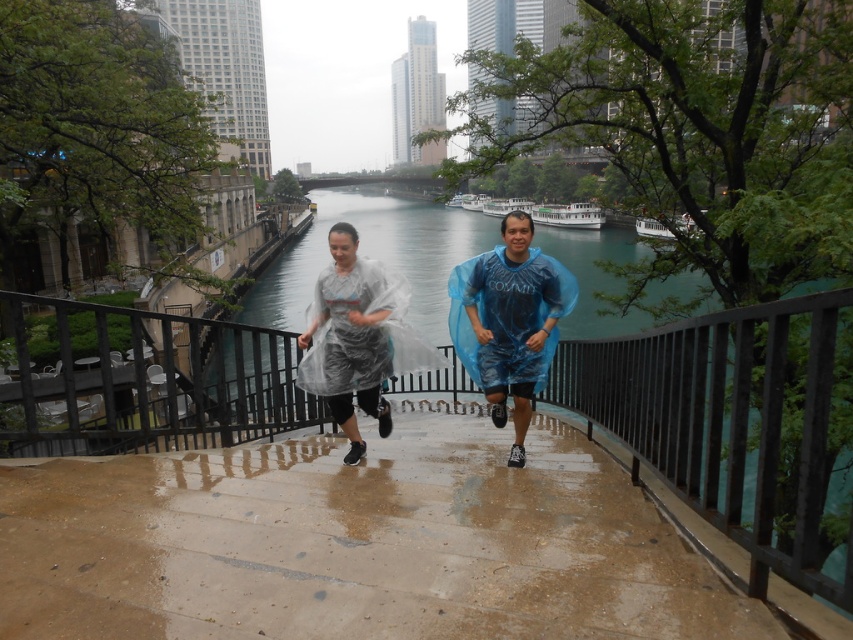
Question: Which point is farther from the camera taking this photo?

Choices:
 (A) (351, 317)
 (B) (502, 602)
 (C) (508, 244)

Answer: (C)

Question: Which object appears closest to the camera in this image?

Choices:
 (A) blue translucent poncho at center
 (B) brown concrete stairs at center

Answer: (B)

Question: Is brown concrete stairs at center smaller than blue translucent poncho at center?

Choices:
 (A) no
 (B) yes

Answer: (B)

Question: Is brown concrete stairs at center bigger than blue translucent poncho at center?

Choices:
 (A) no
 (B) yes

Answer: (A)

Question: From the image, what is the correct spatial relationship of brown concrete stairs at center in relation to transparent plastic poncho at center?

Choices:
 (A) right
 (B) left

Answer: (A)

Question: Which object is farther from the camera taking this photo?

Choices:
 (A) blue translucent poncho at center
 (B) transparent plastic poncho at center
 (C) brown concrete stairs at center

Answer: (A)